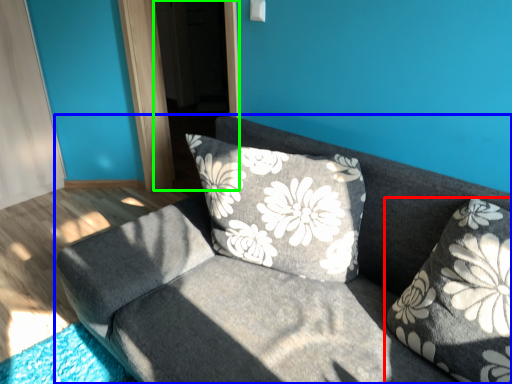
Question: Considering the real-world distances, which object is closest to pillow (highlighted by a red box)? studio couch (highlighted by a blue box) or screen door (highlighted by a green box).

Choices:
 (A) studio couch
 (B) screen door

Answer: (A)